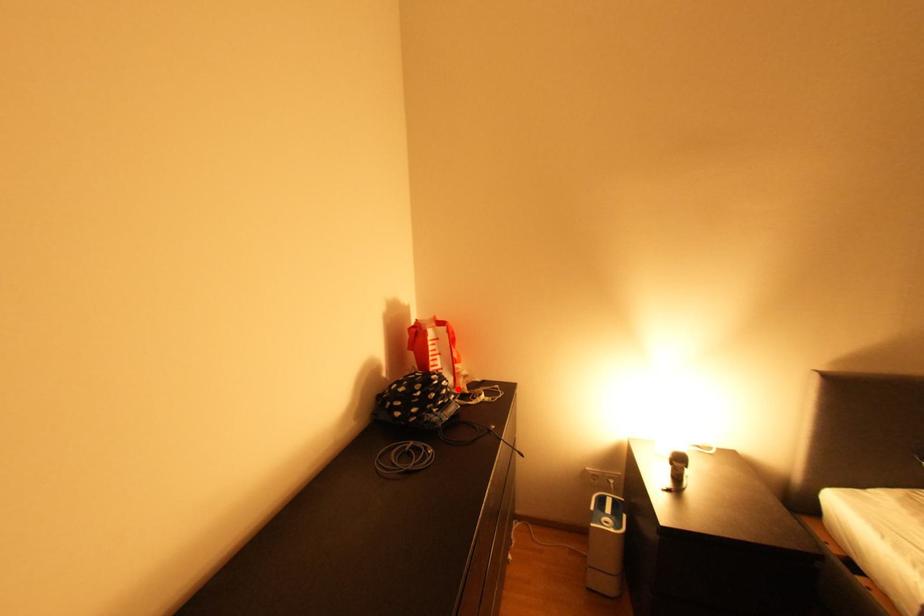
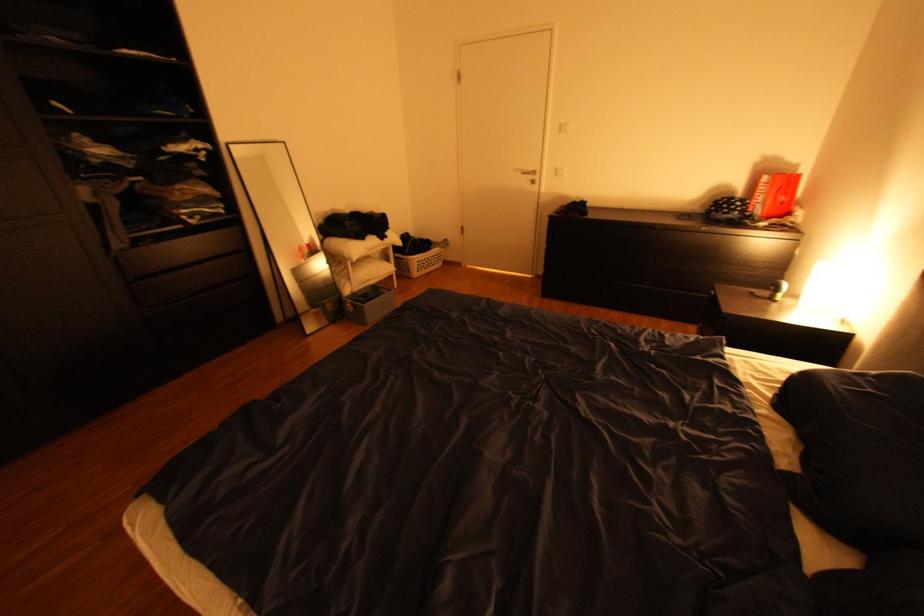
In the second image, find the point that corresponds to the highlighted location in the first image.

(748, 208)